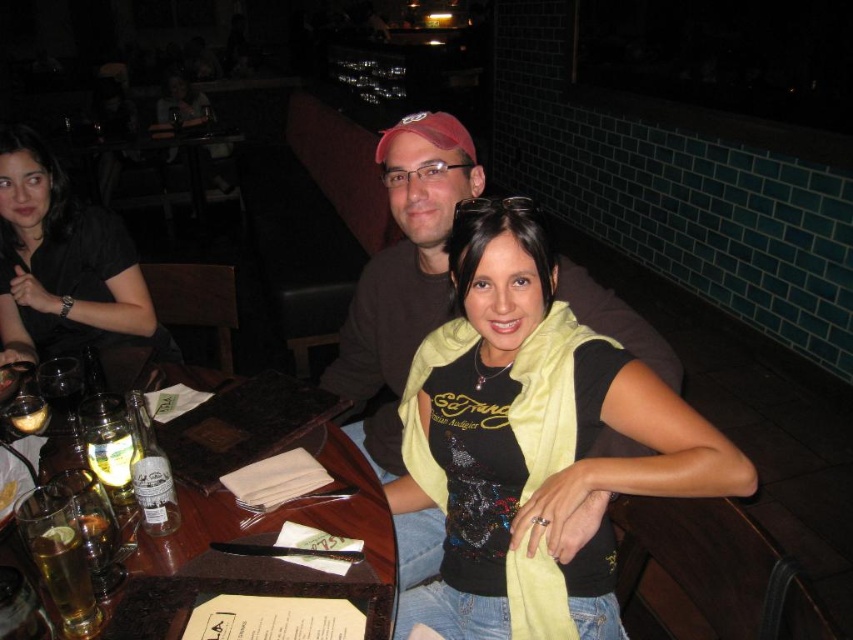
Is wooden table at lower left further to camera compared to translucent glass beer at lower left?

Yes, wooden table at lower left is behind translucent glass beer at lower left.

Between wooden table at lower left and translucent glass beer at lower left, which one is positioned higher?

wooden table at lower left is higher up.

Between point (329, 460) and point (78, 573), which one is positioned behind?

The point (329, 460) is more distant.

This screenshot has width=853, height=640. I want to click on wooden table at lower left, so (x=277, y=528).

Between satin yellow scarf at center and wooden table at lower left, which one appears on the left side from the viewer's perspective?

Positioned to the left is wooden table at lower left.

Can you confirm if satin yellow scarf at center is taller than wooden table at lower left?

Yes, satin yellow scarf at center is taller than wooden table at lower left.

Is point (514, 573) behind point (198, 538)?

Yes.

Image resolution: width=853 pixels, height=640 pixels. What are the coordinates of `satin yellow scarf at center` in the screenshot? It's located at (532, 442).

In the scene shown: Does satin yellow scarf at center have a larger size compared to matte black shirt at upper left?

Yes.

Is the position of satin yellow scarf at center less distant than that of matte black shirt at upper left?

Yes.

This screenshot has height=640, width=853. I want to click on satin yellow scarf at center, so click(x=532, y=442).